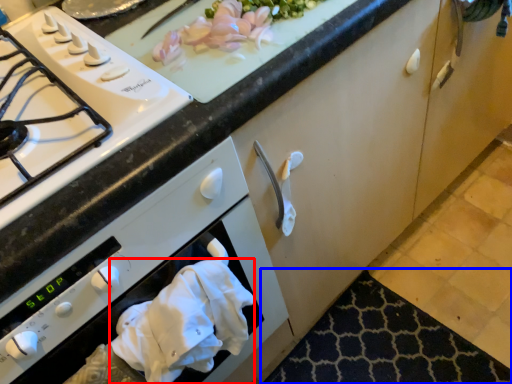
Question: Which of the following is the closest to the observer, hand towel (highlighted by a red box) or mat (highlighted by a blue box)?

Choices:
 (A) hand towel
 (B) mat

Answer: (A)